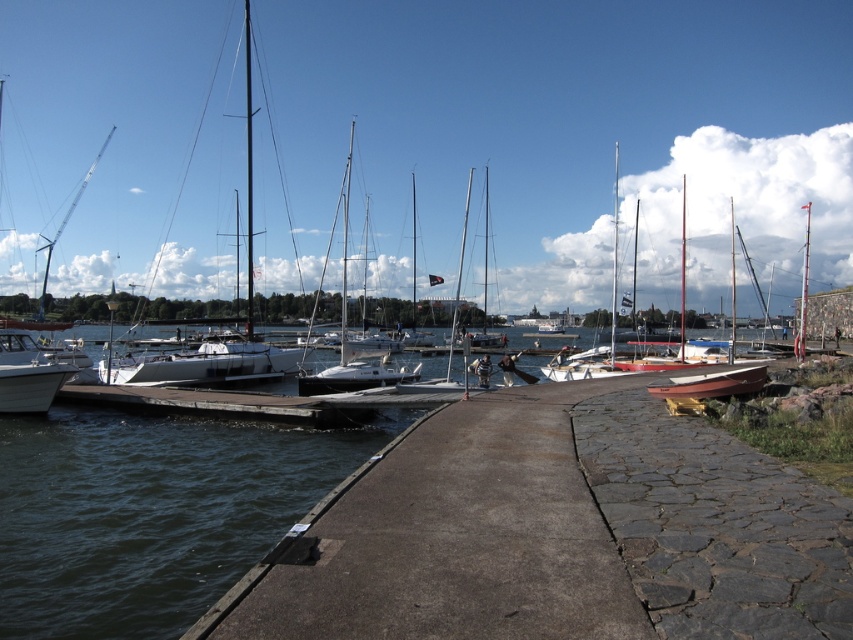
Is dark blue water at lower left above wooden boat at center?

No, dark blue water at lower left is not above wooden boat at center.

Is dark blue water at lower left further to the viewer compared to wooden boat at center?

No, it is in front of wooden boat at center.

Which is behind, point (136, 451) or point (688, 390)?

Positioned behind is point (136, 451).

The image size is (853, 640). What are the coordinates of `dark blue water at lower left` in the screenshot? It's located at (151, 512).

Does concrete dock at center have a lesser height compared to wooden boat at center?

Incorrect, concrete dock at center's height does not fall short of wooden boat at center's.

Is concrete dock at center above wooden boat at center?

No.

Which is in front, point (605, 634) or point (695, 394)?

Point (605, 634) is more forward.

This screenshot has height=640, width=853. In order to click on concrete dock at center in this screenshot , I will do `click(556, 532)`.

Does concrete dock at center appear on the left side of white glossy boat at lower left?

In fact, concrete dock at center is to the right of white glossy boat at lower left.

Is concrete dock at center closer to camera compared to white glossy boat at lower left?

Yes.

This screenshot has width=853, height=640. In order to click on concrete dock at center in this screenshot , I will do `click(556, 532)`.